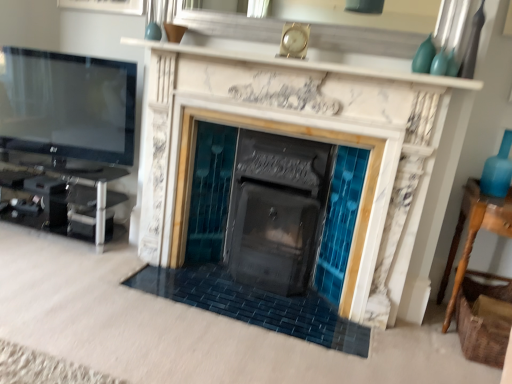
Question: Is white marble mantle at upper center oriented away from matte glass vase at upper right, positioned as the 2th turquoise in front-to-back order?

Choices:
 (A) yes
 (B) no

Answer: (B)

Question: Considering the relative sizes of white marble mantle at upper center and matte glass vase at upper right, positioned as the 2th turquoise in front-to-back order, in the image provided, is white marble mantle at upper center bigger than matte glass vase at upper right, positioned as the 2th turquoise in front-to-back order,?

Choices:
 (A) yes
 (B) no

Answer: (A)

Question: From the image's perspective, is white marble mantle at upper center above matte glass vase at upper right, positioned as the 2th turquoise in front-to-back order?

Choices:
 (A) no
 (B) yes

Answer: (B)

Question: Is white marble mantle at upper center not within matte glass vase at upper right, which is the 1th turquoise in back-to-front order?

Choices:
 (A) yes
 (B) no

Answer: (A)

Question: Can you confirm if white marble mantle at upper center is smaller than matte glass vase at upper right, which is the 1th turquoise in back-to-front order?

Choices:
 (A) no
 (B) yes

Answer: (A)

Question: From the image's perspective, is white marble mantle at upper center beneath matte glass vase at upper right, positioned as the 2th turquoise in front-to-back order?

Choices:
 (A) yes
 (B) no

Answer: (B)

Question: Does flat screen tv at left come behind marble fireplace at center?

Choices:
 (A) no
 (B) yes

Answer: (B)

Question: Does flat screen tv at left have a greater width compared to marble fireplace at center?

Choices:
 (A) no
 (B) yes

Answer: (A)

Question: Is flat screen tv at left turned away from marble fireplace at center?

Choices:
 (A) yes
 (B) no

Answer: (B)

Question: Is flat screen tv at left smaller than marble fireplace at center?

Choices:
 (A) no
 (B) yes

Answer: (B)

Question: Is flat screen tv at left outside of marble fireplace at center?

Choices:
 (A) no
 (B) yes

Answer: (B)

Question: Could you tell me if flat screen tv at left is turned towards marble fireplace at center?

Choices:
 (A) yes
 (B) no

Answer: (B)

Question: Considering the relative sizes of turquoise glass vase at upper right, which is the second turquoise in back-to-front order, and marble fireplace at center in the image provided, is turquoise glass vase at upper right, which is the second turquoise in back-to-front order, taller than marble fireplace at center?

Choices:
 (A) yes
 (B) no

Answer: (B)